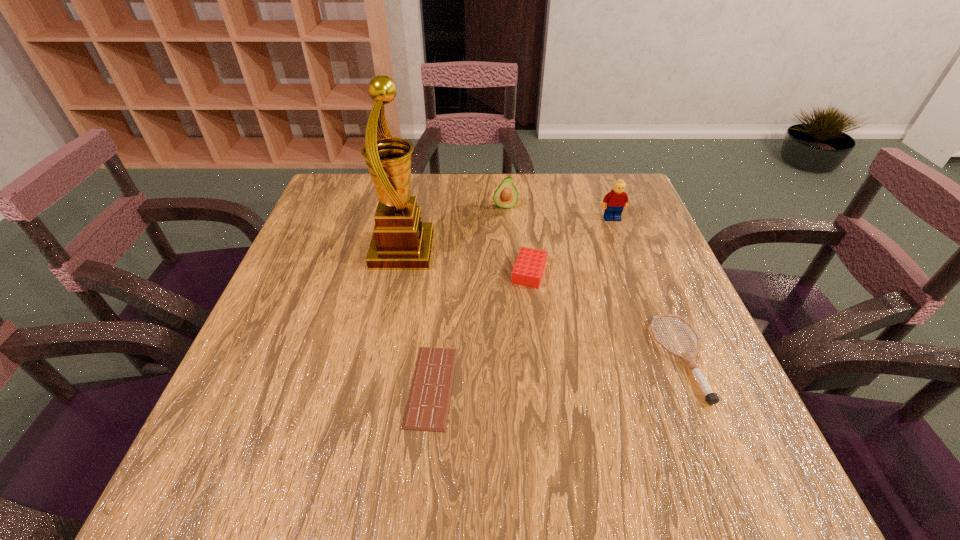
Where is `free space located 0.260m on the front-facing side of the farther Lego`? free space located 0.260m on the front-facing side of the farther Lego is located at coordinates (638, 291).

You are a GUI agent. You are given a task and a screenshot of the screen. Output one action in this format:
    pyautogui.click(x=<x>, y=<y>)
    Task: Click on the vacant space situated on the cut side of the farthest object
    The height and width of the screenshot is (540, 960).
    Given the screenshot: What is the action you would take?
    pyautogui.click(x=509, y=261)

Where is `vacant space located 0.190m on the front of the nearer Lego`? vacant space located 0.190m on the front of the nearer Lego is located at coordinates (540, 358).

This screenshot has height=540, width=960. Find the location of `blank space located on the left of the fifth tallest object`. blank space located on the left of the fifth tallest object is located at coordinates (508, 358).

Identify the location of vacant space located on the right of the chocolate bar. (533, 387).

Find the location of a particular element. This screenshot has height=540, width=960. Lego located in the far edge section of the desktop is located at coordinates (617, 199).

In order to click on avocado situated at the far edge in this screenshot , I will do `click(506, 196)`.

The image size is (960, 540). Identify the location of Lego positioned at the right edge. (617, 199).

Image resolution: width=960 pixels, height=540 pixels. I want to click on tennis racket that is at the right edge, so tap(711, 398).

At what (x,y) coordinates should I click in order to perform the action: click on object that is at the far right corner. Please return your answer as a coordinate pair (x, y). This screenshot has width=960, height=540. Looking at the image, I should click on (617, 199).